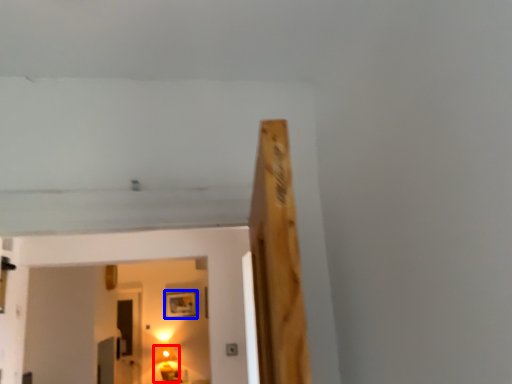
Question: Which object is further to the camera taking this photo, lamp (highlighted by a red box) or picture frame (highlighted by a blue box)?

Choices:
 (A) lamp
 (B) picture frame

Answer: (B)